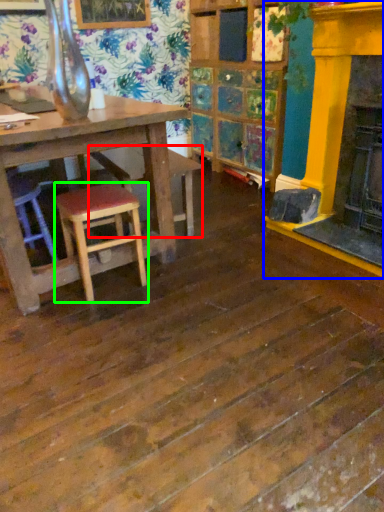
Question: Considering the real-world distances, which object is farthest from bar stool (highlighted by a red box)? fireplace (highlighted by a blue box) or stool (highlighted by a green box)?

Choices:
 (A) fireplace
 (B) stool

Answer: (A)